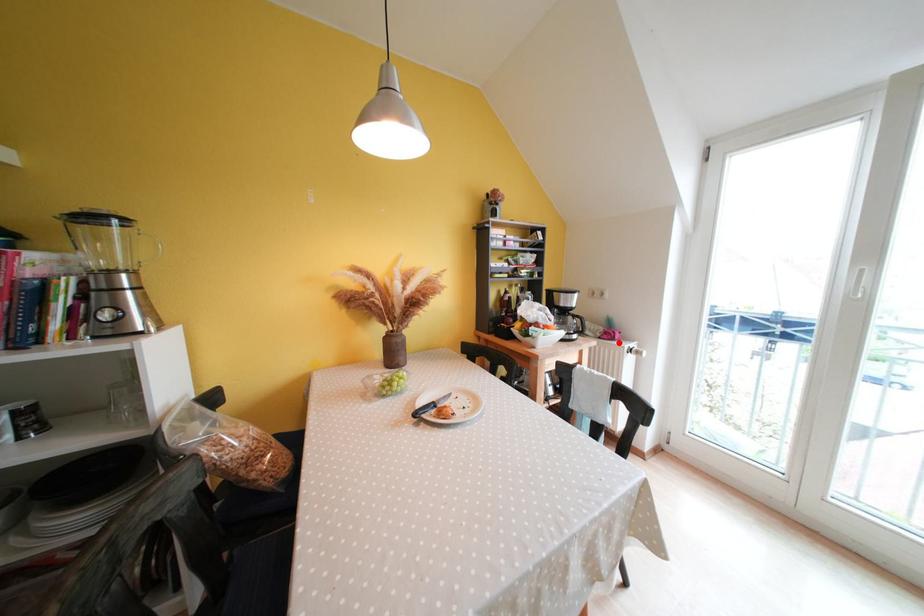
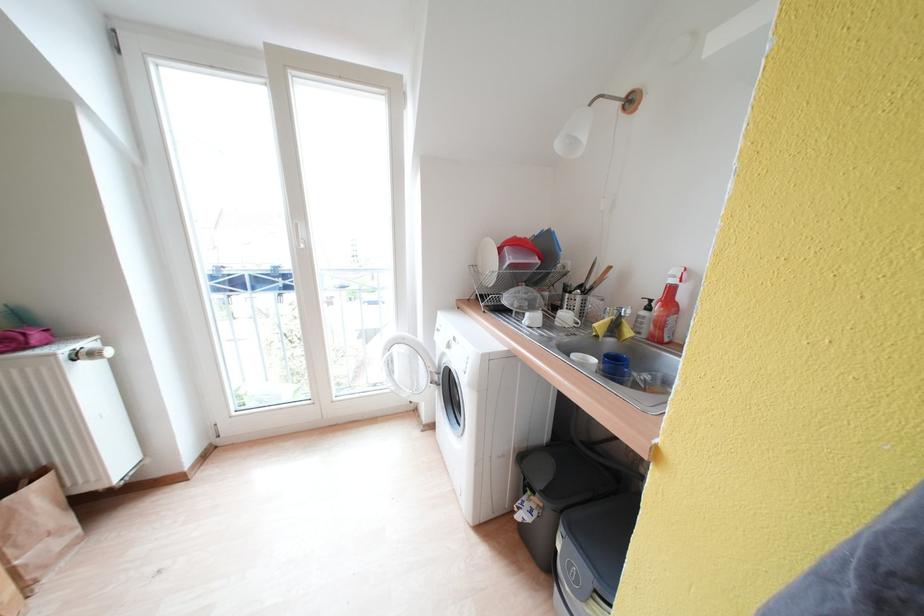
Locate, in the second image, the point that corresponds to the highlighted location in the first image.

(30, 351)